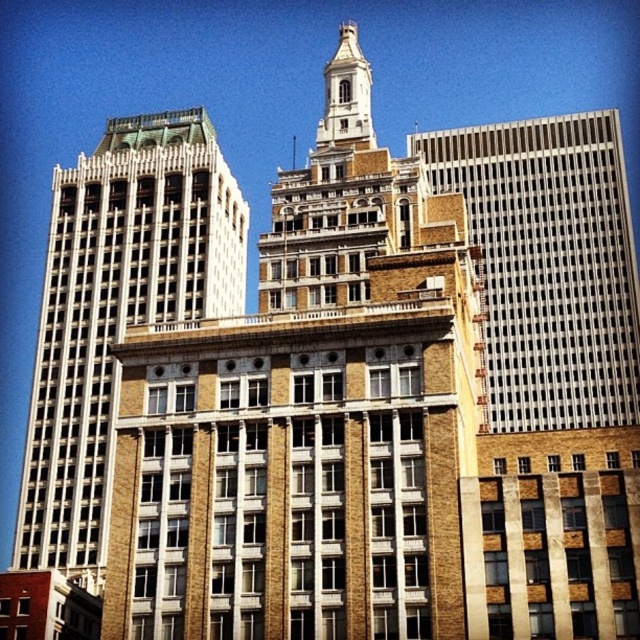
You are a drone operator tasked with capturing aerial footage of the brown brick bell tower at upper left. The coordinates provided are point (116, 310). Based on the scene description, can you confirm if this point corresponds to the bell tower?

Yes, the point (116, 310) marks the brown brick bell tower at upper left as per the description.

You are an architect analyzing the urban layout. Based on the scene, which building is positioned further away from the viewer between the white glass skyscraper at right and the brown stone tower at upper center?

The brown stone tower at upper center is positioned behind the white glass skyscraper at right, meaning it is further away from the viewer.

You are an architect analyzing the skyline of this city block. You notice the brown brick bell tower at upper left and the brown stone tower at upper center. Which of these two structures has a greater height?

The brown brick bell tower at upper left is not as tall as the brown stone tower at upper center, so the brown stone tower at upper center is taller.